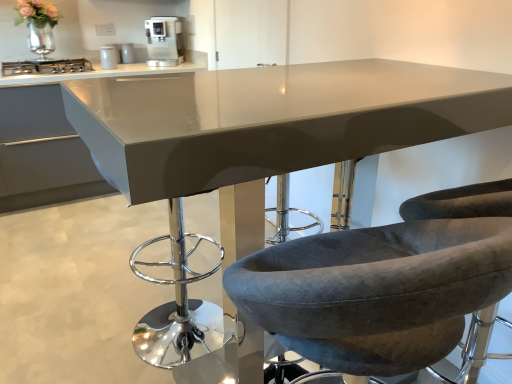
This screenshot has width=512, height=384. Describe the element at coordinates (164, 41) in the screenshot. I see `satin silver coffee machine at upper center` at that location.

This screenshot has height=384, width=512. I want to click on satin white countertop at upper left, so click(x=53, y=141).

Describe the element at coordinates (461, 202) in the screenshot. I see `velvet grey chair at center, acting as the second chair starting from the left` at that location.

Identify the location of metallic silver canister at upper center, the 2th appliance from the front. This screenshot has width=512, height=384. (127, 53).

What do you see at coordinates (108, 57) in the screenshot?
I see `metallic silver coffee machine at upper center, which ranks as the 1th appliance in front-to-back order` at bounding box center [108, 57].

Where is `satin silver coffee machine at upper center`? satin silver coffee machine at upper center is located at coordinates (164, 41).

Based on the photo, which object is further away from the camera, metallic silver canister at upper center, the 2th appliance from the front, or stainless steel stove at left?

Positioned behind is metallic silver canister at upper center, the 2th appliance from the front.

Could you tell me if metallic silver canister at upper center, positioned as the first appliance in top-to-bottom order, is turned towards stainless steel stove at left?

No, metallic silver canister at upper center, positioned as the first appliance in top-to-bottom order, is not aimed at stainless steel stove at left.

Is stainless steel stove at left a part of metallic silver canister at upper center, which appears as the 1th appliance when viewed from the back?

Actually, stainless steel stove at left is outside metallic silver canister at upper center, which appears as the 1th appliance when viewed from the back.

Identify the location of the 2nd chair in front of the metallic silver canister at upper center, which appears as the 1th appliance when viewed from the back, starting your count from the anchor. (376, 291).

Is metallic silver canister at upper center, the 2th appliance from the front, not near velvet grey chair at center, arranged as the 1th chair when viewed from the left?

metallic silver canister at upper center, the 2th appliance from the front, is far away from velvet grey chair at center, arranged as the 1th chair when viewed from the left.

Can you confirm if metallic silver canister at upper center, the second appliance positioned from the bottom, is bigger than velvet grey chair at center, the second chair positioned from the right?

No, metallic silver canister at upper center, the second appliance positioned from the bottom, is not bigger than velvet grey chair at center, the second chair positioned from the right.

This screenshot has width=512, height=384. Identify the location of cabinetry below the satin silver coffee machine at upper center (from the image's perspective). (53, 141).

From a real-world perspective, is satin silver coffee machine at upper center below satin white countertop at upper left?

Actually, satin silver coffee machine at upper center is physically above satin white countertop at upper left in the real world.

Is satin silver coffee machine at upper center oriented towards satin white countertop at upper left?

No, satin silver coffee machine at upper center does not turn towards satin white countertop at upper left.

From the image's perspective, would you say satin silver coffee machine at upper center is positioned over satin white countertop at upper left?

Yes, from the image's perspective, satin silver coffee machine at upper center is above satin white countertop at upper left.

In the scene shown: Who is taller, metallic silver coffee machine at upper center, the second appliance viewed from the top, or stainless steel stove at left?

With more height is metallic silver coffee machine at upper center, the second appliance viewed from the top.

From the image's perspective, relative to stainless steel stove at left, is metallic silver coffee machine at upper center, which ranks as the 1th appliance in front-to-back order, above or below?

metallic silver coffee machine at upper center, which ranks as the 1th appliance in front-to-back order, is above stainless steel stove at left.

Does metallic silver coffee machine at upper center, the second appliance viewed from the top, have a greater width compared to stainless steel stove at left?

→ Incorrect, the width of metallic silver coffee machine at upper center, the second appliance viewed from the top, does not surpass that of stainless steel stove at left.

From a real-world perspective, is metallic silver coffee machine at upper center, the second appliance viewed from the top, above or below metallic silver canister at upper center, which appears as the 1th appliance when viewed from the back?

Clearly, from a real-world perspective, metallic silver coffee machine at upper center, the second appliance viewed from the top, is below metallic silver canister at upper center, which appears as the 1th appliance when viewed from the back.

Is metallic silver coffee machine at upper center, the second appliance viewed from the top, at the left side of metallic silver canister at upper center, positioned as the first appliance in top-to-bottom order?

Yes.

Does point (106, 59) appear closer or farther from the camera than point (128, 44)?

Point (106, 59).

Would you say velvet grey chair at center, arranged as the 1th chair when viewed from the left, is inside or outside metallic silver coffee machine at upper center, marked as the first appliance in a bottom-to-top arrangement?

velvet grey chair at center, arranged as the 1th chair when viewed from the left, is spatially situated outside metallic silver coffee machine at upper center, marked as the first appliance in a bottom-to-top arrangement.

Considering the relative positions of velvet grey chair at center, arranged as the 1th chair when viewed from the left, and metallic silver coffee machine at upper center, the second appliance positioned from the back, in the image provided, is velvet grey chair at center, arranged as the 1th chair when viewed from the left, to the left of metallic silver coffee machine at upper center, the second appliance positioned from the back, from the viewer's perspective?

No, velvet grey chair at center, arranged as the 1th chair when viewed from the left, is not to the left of metallic silver coffee machine at upper center, the second appliance positioned from the back.

Identify the location of the 2nd chair below the metallic silver coffee machine at upper center, the second appliance viewed from the top (from the image's perspective). (376, 291).

In terms of height, does velvet grey chair at center, arranged as the 1th chair when viewed from the left, look taller or shorter compared to metallic silver coffee machine at upper center, which ranks as the 1th appliance in front-to-back order?

In the image, velvet grey chair at center, arranged as the 1th chair when viewed from the left, appears to be taller than metallic silver coffee machine at upper center, which ranks as the 1th appliance in front-to-back order.

Does velvet grey chair at center, which is the 1th chair from right to left, appear on the left side of satin silver coffee machine at upper center?

In fact, velvet grey chair at center, which is the 1th chair from right to left, is to the right of satin silver coffee machine at upper center.

From a real-world perspective, count 2nd chairs downward from the satin silver coffee machine at upper center and point to it. Please provide its 2D coordinates.

[(461, 202)]

Can you confirm if velvet grey chair at center, which is the 1th chair from right to left, is smaller than satin silver coffee machine at upper center?

No.

Find the location of a particular element. This screenshot has height=384, width=512. the 2nd appliance behind the stainless steel stove at left is located at coordinates pyautogui.click(x=127, y=53).

From a real-world perspective, starting from the velvet grey chair at center, arranged as the 1th chair when viewed from the left, which appliance is the 2nd one vertically above it? Please provide its 2D coordinates.

[(127, 53)]

Based on their spatial positions, is velvet grey chair at center, arranged as the 1th chair when viewed from the left, or satin silver coffee machine at upper center further from velvet grey chair at center, acting as the second chair starting from the left?

Among the two, satin silver coffee machine at upper center is located further to velvet grey chair at center, acting as the second chair starting from the left.

Considering their positions, is velvet grey chair at center, the second chair positioned from the right, positioned further to satin white countertop at upper left than velvet grey chair at center, acting as the second chair starting from the left?

Among the two, velvet grey chair at center, acting as the second chair starting from the left, is located further to satin white countertop at upper left.

From the image, which object appears to be nearer to metallic silver canister at upper center, positioned as the first appliance in top-to-bottom order, stainless steel stove at left or satin silver coffee machine at upper center?

Among the two, satin silver coffee machine at upper center is located nearer to metallic silver canister at upper center, positioned as the first appliance in top-to-bottom order.

Estimate the real-world distances between objects in this image. Which object is further from velvet grey chair at center, the second chair positioned from the right, satin silver coffee machine at upper center or metallic silver coffee machine at upper center, the second appliance positioned from the back?

The object further to velvet grey chair at center, the second chair positioned from the right, is metallic silver coffee machine at upper center, the second appliance positioned from the back.

Based on their spatial positions, is satin white countertop at upper left or velvet grey chair at center, the second chair positioned from the right, closer to stainless steel stove at left?

satin white countertop at upper left.

From the image, which object appears to be farther from stainless steel stove at left, metallic silver coffee machine at upper center, which ranks as the 1th appliance in front-to-back order, or satin silver coffee machine at upper center?

The object further to stainless steel stove at left is satin silver coffee machine at upper center.

Looking at the image, which one is located further to metallic silver coffee machine at upper center, marked as the first appliance in a bottom-to-top arrangement, velvet grey chair at center, which is the 1th chair from right to left, or metallic silver canister at upper center, the second appliance positioned from the bottom?

Based on the image, velvet grey chair at center, which is the 1th chair from right to left, appears to be further to metallic silver coffee machine at upper center, marked as the first appliance in a bottom-to-top arrangement.

Looking at the image, which one is located closer to velvet grey chair at center, the second chair positioned from the right, velvet grey chair at center, which is the 1th chair from right to left, or metallic silver coffee machine at upper center, the second appliance viewed from the top?

velvet grey chair at center, which is the 1th chair from right to left, is positioned closer to the anchor velvet grey chair at center, the second chair positioned from the right.

I want to click on cabinetry between velvet grey chair at center, acting as the second chair starting from the left, and metallic silver canister at upper center, the second appliance positioned from the bottom, along the z-axis, so 53,141.

The height and width of the screenshot is (384, 512). I want to click on cabinetry situated between stainless steel stove at left and satin silver coffee machine at upper center from left to right, so click(x=53, y=141).

The height and width of the screenshot is (384, 512). I want to click on cabinetry positioned between velvet grey chair at center, the second chair positioned from the right, and satin silver coffee machine at upper center from near to far, so click(53, 141).

Identify the location of cabinetry between velvet grey chair at center, the second chair positioned from the right, and metallic silver coffee machine at upper center, marked as the first appliance in a bottom-to-top arrangement, in the front-back direction. (53, 141).